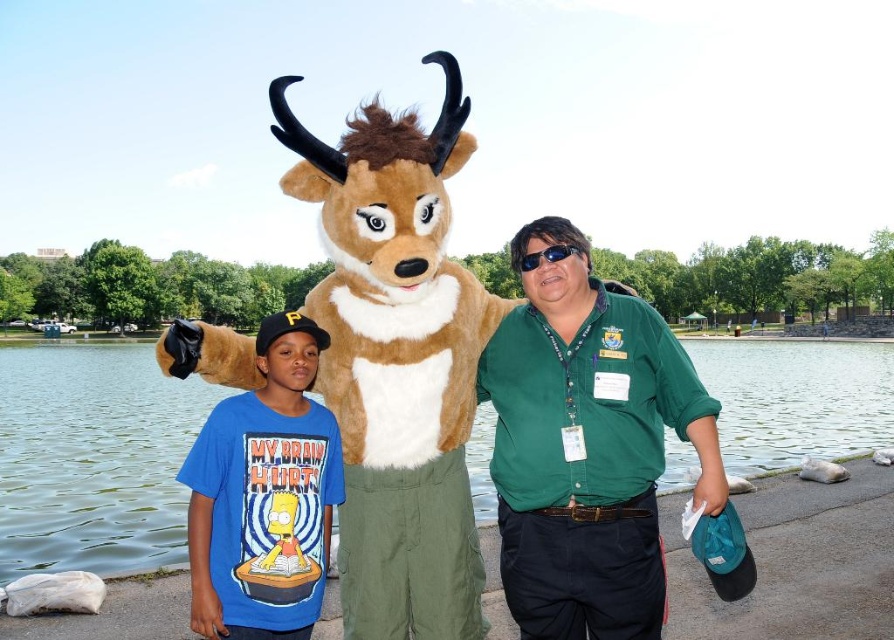
Question: Which of these objects is positioned closest to the green fabric shirt at center?

Choices:
 (A) blue cotton t-shirt at center
 (B) black plastic goggles at center
 (C) clear water at lake center

Answer: (B)

Question: Considering the real-world distances, which object is farthest from the black plastic goggles at center?

Choices:
 (A) blue cotton t-shirt at center
 (B) green fabric shirt at center
 (C) clear water at lake center

Answer: (C)

Question: Is clear water at lake center behind blue cotton t-shirt at center?

Choices:
 (A) no
 (B) yes

Answer: (B)

Question: Which point is farther to the camera?

Choices:
 (A) (508, 488)
 (B) (859, 396)
 (C) (527, 272)

Answer: (B)

Question: In this image, where is blue cotton t-shirt at center located relative to black plastic goggles at center?

Choices:
 (A) below
 (B) above

Answer: (A)

Question: Can you confirm if blue cotton t-shirt at center is smaller than black plastic goggles at center?

Choices:
 (A) no
 (B) yes

Answer: (B)